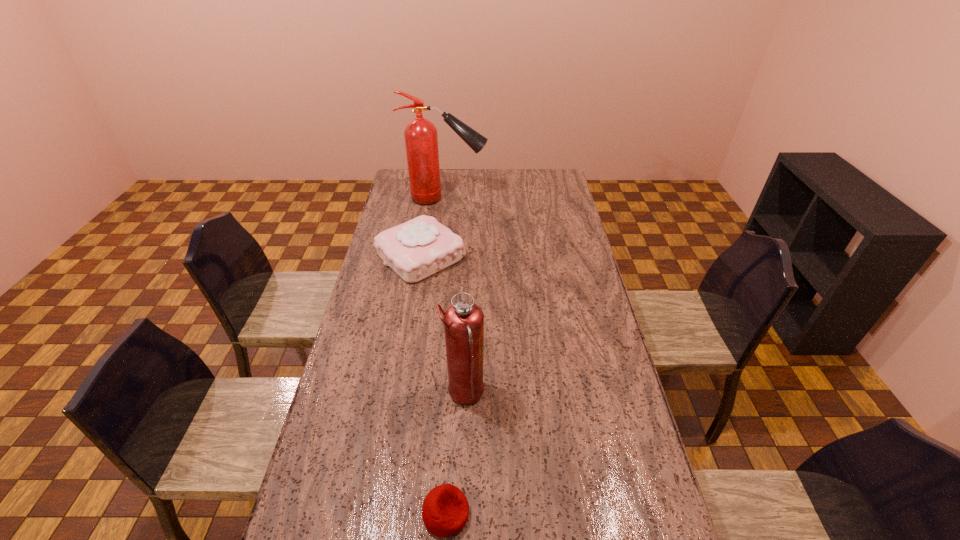
At what (x,y) coordinates should I click in order to perform the action: click on free area in between the third farthest object and the shortest object. Please return your answer as a coordinate pair (x, y). Image resolution: width=960 pixels, height=540 pixels. Looking at the image, I should click on (x=455, y=454).

Identify the location of vacant area that lies between the third nearest object and the shortest object. This screenshot has width=960, height=540. (433, 384).

Identify the location of vacant point located between the third nearest object and the beanbag. (433, 384).

Identify the location of free spot between the second farthest object and the shorter fire extinguisher. (443, 325).

At what (x,y) coordinates should I click in order to perform the action: click on free space between the nearer fire extinguisher and the cake. Please return your answer as a coordinate pair (x, y). Looking at the image, I should click on (443, 325).

The image size is (960, 540). What are the coordinates of `empty space between the shortest object and the third nearest object` in the screenshot? It's located at (433, 384).

Locate an element on the screen. The image size is (960, 540). vacant space that is in between the nearest object and the third farthest object is located at coordinates (455, 454).

This screenshot has width=960, height=540. Identify the location of vacant space that's between the cake and the beanbag. (433, 384).

At what (x,y) coordinates should I click in order to perform the action: click on the third closest object to the third tallest object. Please return your answer as a coordinate pair (x, y). This screenshot has width=960, height=540. Looking at the image, I should click on (445, 510).

Select which object appears as the second closest to the tallest object. Please provide its 2D coordinates. Your answer should be formatted as a tuple, i.e. [(x, y)], where the tuple contains the x and y coordinates of a point satisfying the conditions above.

[(463, 321)]